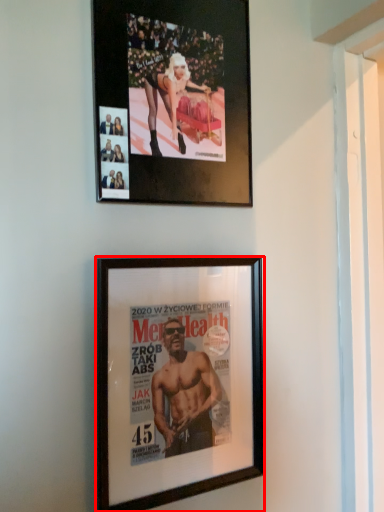
Question: From the image's perspective, where is picture frame (annotated by the red box) located in relation to picture frame in the image?

Choices:
 (A) below
 (B) above

Answer: (A)